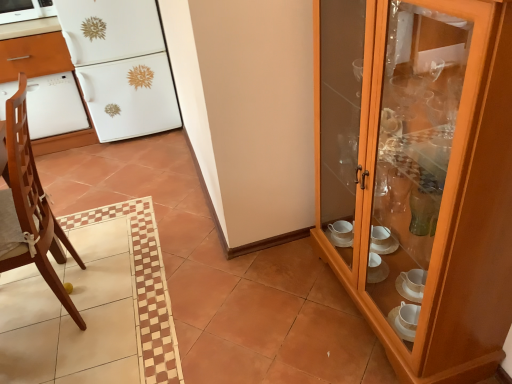
Describe the element at coordinates (29, 208) in the screenshot. I see `brown wooden chair at left` at that location.

Based on the photo, measure the distance between point (484, 158) and camera.

Point (484, 158) is 35.75 inches away from camera.

What do you see at coordinates (420, 173) in the screenshot? I see `wooden cabinet at right` at bounding box center [420, 173].

The height and width of the screenshot is (384, 512). I want to click on white glossy refrigerator at upper left, so click(x=121, y=66).

Image resolution: width=512 pixels, height=384 pixels. In order to click on brown wooden chair at left in this screenshot , I will do `click(29, 208)`.

I want to click on oven located underneath the brown wooden chair at left (from a real-world perspective), so click(x=54, y=106).

What's the angular difference between brown wooden chair at left and white glossy oven at left's facing directions?

90 degrees.

In the scene shown: From a real-world perspective, which object stands above the other?

brown wooden chair at left is physically above.

Is brown wooden chair at left located outside white glossy oven at left?

Indeed, brown wooden chair at left is completely outside white glossy oven at left.

Relative to brown wooden chair at left, is white glossy microwave at upper left in front or behind?

Clearly, white glossy microwave at upper left is behind brown wooden chair at left.

Between white glossy microwave at upper left and brown wooden chair at left, which one has larger width?

brown wooden chair at left.

What's the angular difference between white glossy microwave at upper left and brown wooden chair at left's facing directions?

The angle between the facing direction of white glossy microwave at upper left and the facing direction of brown wooden chair at left is 90 degrees.

Can you tell me how much white glossy oven at left and white glossy refrigerator at upper left differ in facing direction?

The angle between the facing direction of white glossy oven at left and the facing direction of white glossy refrigerator at upper left is 0.000121 degrees.

Is white glossy oven at left situated inside white glossy refrigerator at upper left or outside?

white glossy oven at left is outside white glossy refrigerator at upper left.

Is point (45, 120) positioned before point (172, 83)?

Yes, it is in front of point (172, 83).

From the image's perspective, is white glossy oven at left above or below white glossy refrigerator at upper left?

white glossy oven at left is below white glossy refrigerator at upper left.

Based on the photo, is brown wooden chair at left facing away from white glossy dishwasher at left?

That's not correct — brown wooden chair at left is not looking away from white glossy dishwasher at left.

From the picture: What's the angular difference between brown wooden chair at left and white glossy dishwasher at left's facing directions?

The angle between the facing direction of brown wooden chair at left and the facing direction of white glossy dishwasher at left is 89.1 degrees.

Find the location of a particular element. desk behind the brown wooden chair at left is located at coordinates (33, 49).

From a real-world perspective, which object stands above the other?

brown wooden chair at left is physically above.

Can you tell me how much white glossy oven at left and white glossy microwave at upper left differ in facing direction?

0.000218 degrees separate the facing orientations of white glossy oven at left and white glossy microwave at upper left.

From the image's perspective, is white glossy oven at left beneath white glossy microwave at upper left?

Yes.

From a real-world perspective, is white glossy oven at left positioned above or below white glossy microwave at upper left?

From a real-world perspective, white glossy oven at left is physically below white glossy microwave at upper left.

Could you tell me if white glossy oven at left is turned towards white glossy microwave at upper left?

No, white glossy oven at left is not facing towards white glossy microwave at upper left.

The height and width of the screenshot is (384, 512). I want to click on chair that appears on the right of white glossy refrigerator at upper left, so click(29, 208).

Which of these two, white glossy refrigerator at upper left or brown wooden chair at left, is smaller?

brown wooden chair at left.

Consider the image. Is white glossy refrigerator at upper left positioned before brown wooden chair at left?

No, white glossy refrigerator at upper left is further to the viewer.

In terms of width, does white glossy refrigerator at upper left look wider or thinner when compared to brown wooden chair at left?

Considering their sizes, white glossy refrigerator at upper left looks broader than brown wooden chair at left.

In the image, is wooden cabinet at right on the left side or the right side of white glossy dishwasher at left?

In the image, wooden cabinet at right appears on the right side of white glossy dishwasher at left.

Which object is closer to the camera, wooden cabinet at right or white glossy dishwasher at left?

Positioned in front is wooden cabinet at right.

Considering the sizes of objects wooden cabinet at right and white glossy dishwasher at left in the image provided, who is smaller, wooden cabinet at right or white glossy dishwasher at left?

white glossy dishwasher at left.

Locate an element on the screen. The width and height of the screenshot is (512, 384). oven located behind the brown wooden chair at left is located at coordinates (54, 106).

Where is `chair below the white glossy microwave at upper left (from a real-world perspective)`? chair below the white glossy microwave at upper left (from a real-world perspective) is located at coordinates (29, 208).

When comparing their distances from white glossy oven at left, does white glossy dishwasher at left or white glossy microwave at upper left seem closer?

white glossy dishwasher at left.

Estimate the real-world distances between objects in this image. Which object is further from white glossy dishwasher at left, wooden cabinet at right or white glossy oven at left?

Among the two, wooden cabinet at right is located further to white glossy dishwasher at left.

Looking at the image, which one is located closer to white glossy microwave at upper left, white glossy dishwasher at left or wooden cabinet at right?

white glossy dishwasher at left.

Considering their positions, is white glossy refrigerator at upper left positioned further to white glossy microwave at upper left than white glossy oven at left?

white glossy refrigerator at upper left.

Considering their positions, is wooden cabinet at right positioned further to white glossy microwave at upper left than brown wooden chair at left?

wooden cabinet at right lies further to white glossy microwave at upper left than the other object.

Based on their spatial positions, is white glossy refrigerator at upper left or wooden cabinet at right further from white glossy dishwasher at left?

wooden cabinet at right lies further to white glossy dishwasher at left than the other object.

Based on their spatial positions, is white glossy dishwasher at left or wooden cabinet at right closer to brown wooden chair at left?

white glossy dishwasher at left lies closer to brown wooden chair at left than the other object.

Which object lies further to the anchor point brown wooden chair at left, white glossy microwave at upper left or white glossy dishwasher at left?

white glossy microwave at upper left.

Where is `desk between brown wooden chair at left and white glossy oven at left along the z-axis`? The width and height of the screenshot is (512, 384). desk between brown wooden chair at left and white glossy oven at left along the z-axis is located at coordinates (33, 49).

Find the location of a particular element. The width and height of the screenshot is (512, 384). desk between white glossy microwave at upper left and wooden cabinet at right is located at coordinates (33, 49).

Locate an element on the screen. The image size is (512, 384). refrigerator located between wooden cabinet at right and white glossy dishwasher at left in the depth direction is located at coordinates 121,66.

Find the location of a particular element. This screenshot has width=512, height=384. oven between white glossy dishwasher at left and wooden cabinet at right is located at coordinates click(54, 106).